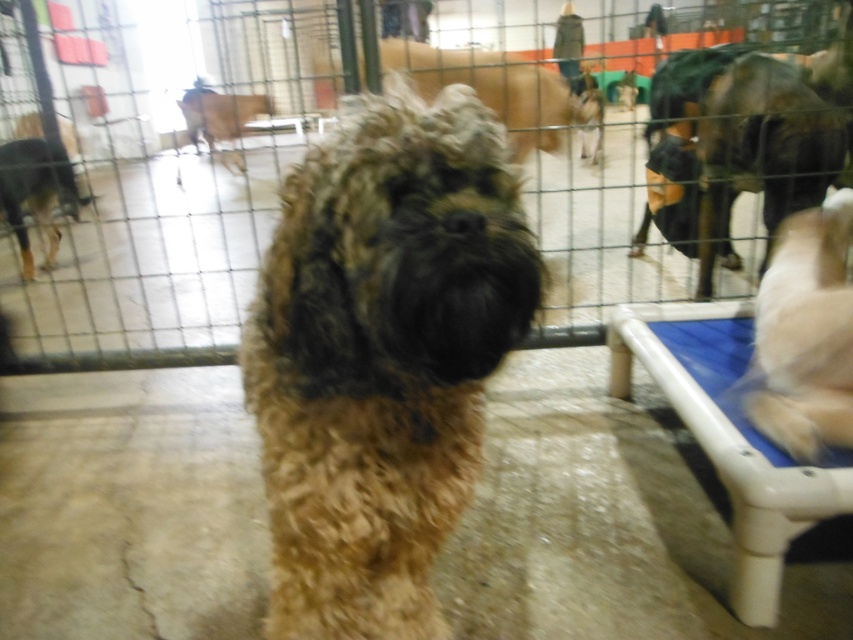
Question: Can you confirm if fuzzy brown dog at center is thinner than black fur dog at left?

Choices:
 (A) no
 (B) yes

Answer: (B)

Question: Which object is positioned closest to the fuzzy brown dog at center?

Choices:
 (A) metal wire fence at center
 (B) white fluffy dog at right
 (C) black fur dog at left

Answer: (B)

Question: Does fuzzy brown dog at center appear on the left side of white fluffy dog at right?

Choices:
 (A) yes
 (B) no

Answer: (A)

Question: Which object is closer to the camera taking this photo?

Choices:
 (A) white fluffy dog at right
 (B) metal wire fence at center
 (C) fuzzy brown dog at center

Answer: (C)

Question: Which object is farther from the camera taking this photo?

Choices:
 (A) fuzzy brown dog at center
 (B) metal wire fence at center

Answer: (B)

Question: Is metal wire fence at center positioned before white fluffy dog at right?

Choices:
 (A) no
 (B) yes

Answer: (B)